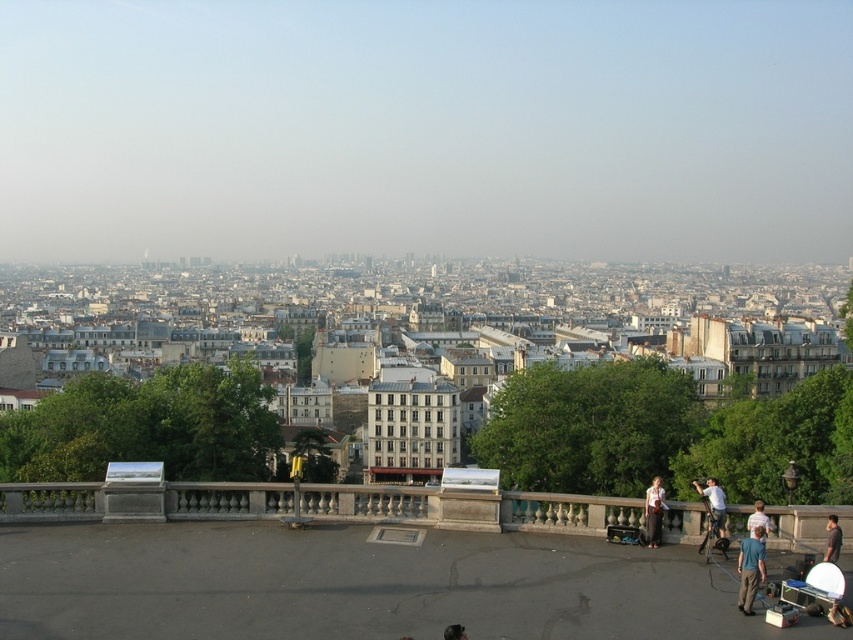
You are a photographer looking for the blue fabric shirt at lower right and the light brown leather jacket at lower right in the scene. Which one is positioned higher in the image?

The blue fabric shirt at lower right is above the light brown leather jacket at lower right, so the blue fabric shirt at lower right is positioned higher in the image.

You are a photographer in the city. You see a white cotton shirt at lower right and a gray fabric bag at lower right. Which item is closer to you?

The white cotton shirt at lower right is closer to you because it is further to the viewer than the gray fabric bag at lower right.